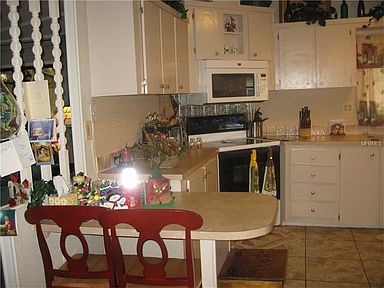
Image resolution: width=384 pixels, height=288 pixels. Identify the location of oven. (225, 159).